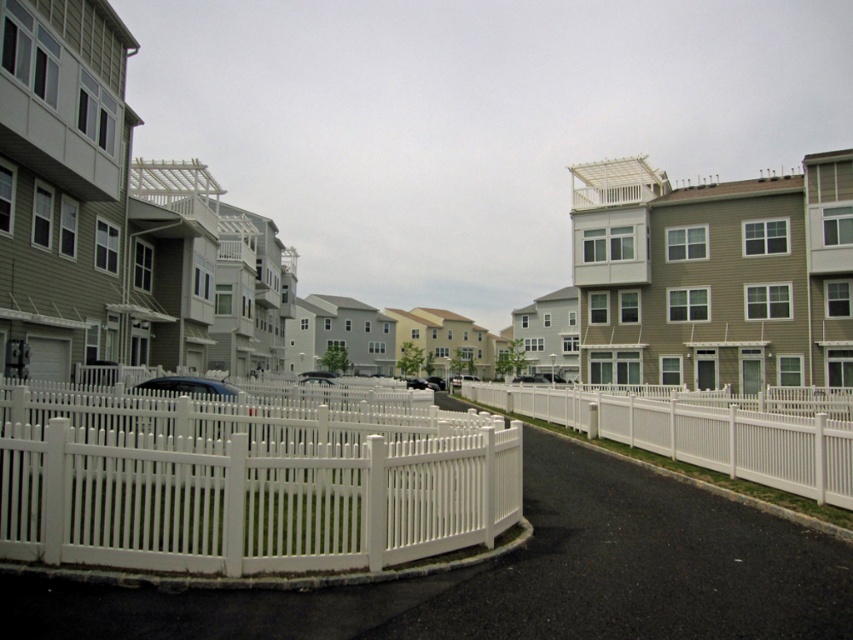
You are a delivery person trying to determine which fence you can easily see over while driving past the residential area. The white picket fence at center and the white vinyl fence at center are both along the road. Which fence is shorter?

The white picket fence at center is not as tall as the white vinyl fence at center, so the white picket fence at center is shorter and easier to see over.

You are a delivery person trying to determine which fence is closer to the road in the residential area. The scene shows a white picket fence at center and a white vinyl fence at center. Which fence is closer to the road?

The white picket fence at center is closer to the road since it has a smaller size compared to the white vinyl fence at center, indicating it is positioned in front.